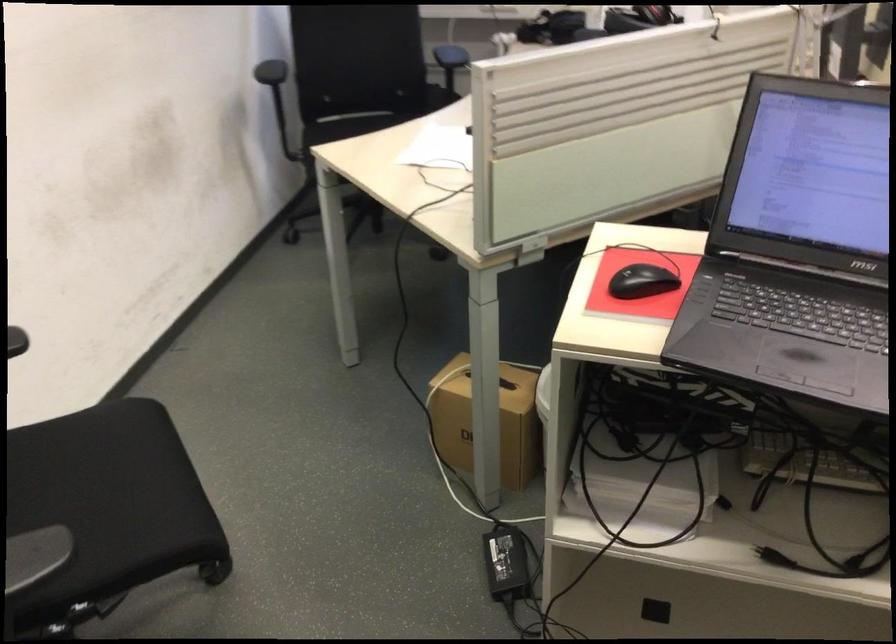
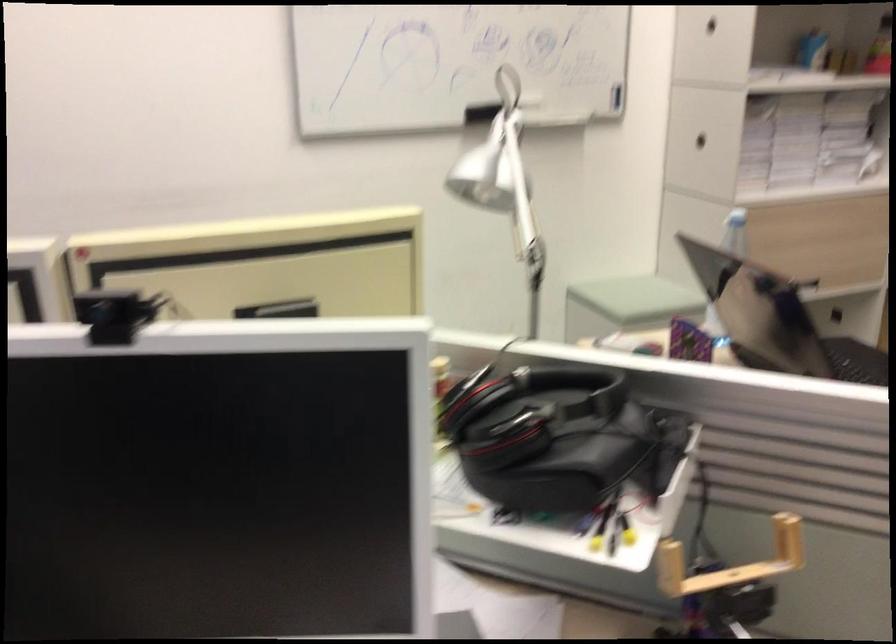
Locate, in the second image, the point that corresponds to point 582,187 in the first image.

(730, 562)